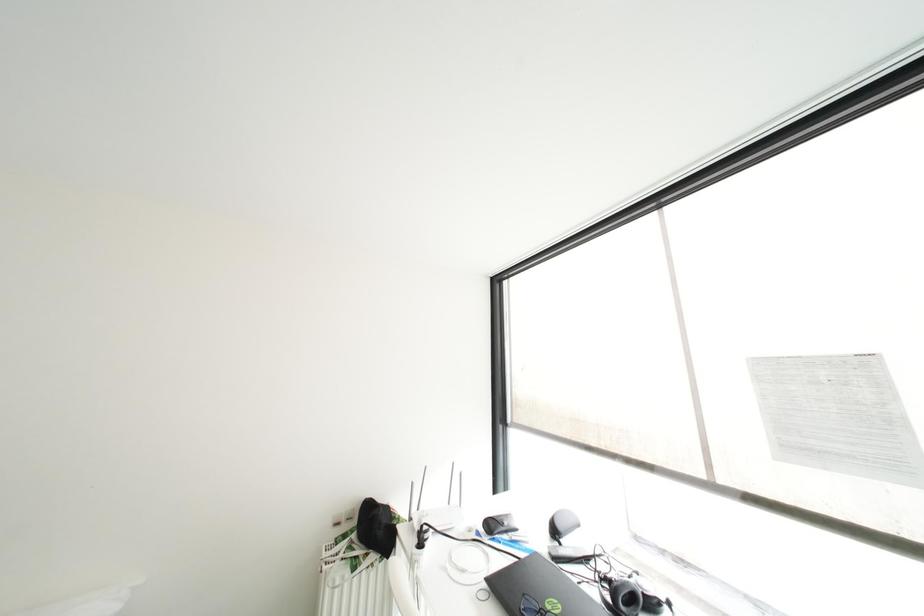
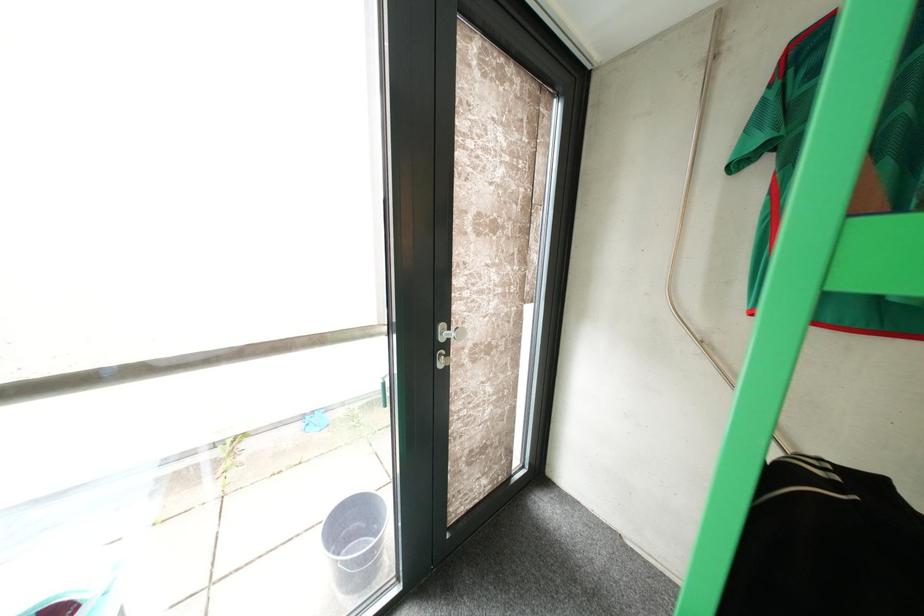
Question: The camera is either moving clockwise (left) or counter-clockwise (right) around the object. The first image is from the beginning of the video and the second image is from the end. Is the camera moving left or right when shooting the video?

Choices:
 (A) Left
 (B) Right

Answer: (A)